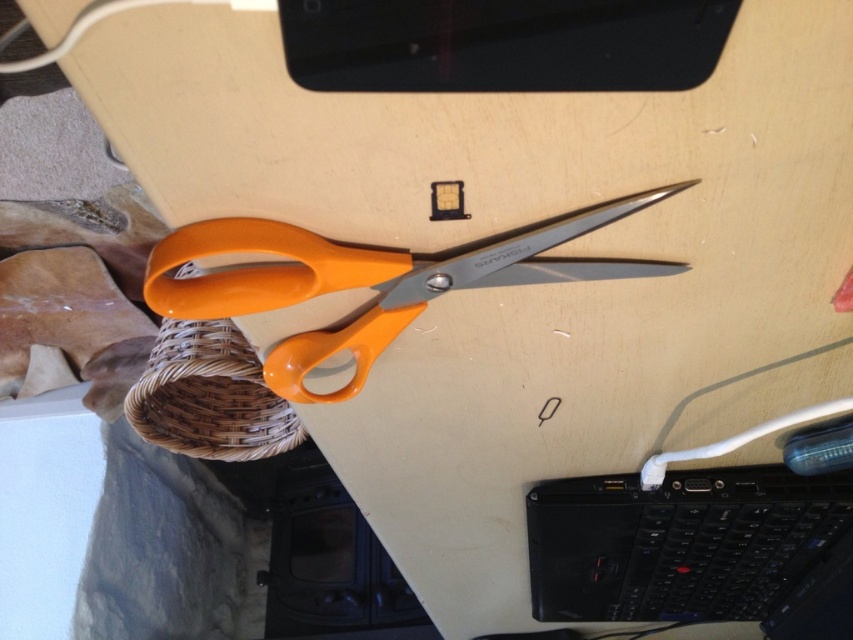
The image size is (853, 640). Describe the element at coordinates (691, 531) in the screenshot. I see `black plastic laptop at lower right` at that location.

Can you confirm if black plastic laptop at lower right is positioned below orange plastic scissors at center?

Yes, black plastic laptop at lower right is below orange plastic scissors at center.

Measure the distance between point (840, 474) and camera.

Point (840, 474) is 31.95 inches from camera.

Locate an element on the screen. black plastic laptop at lower right is located at coordinates (691, 531).